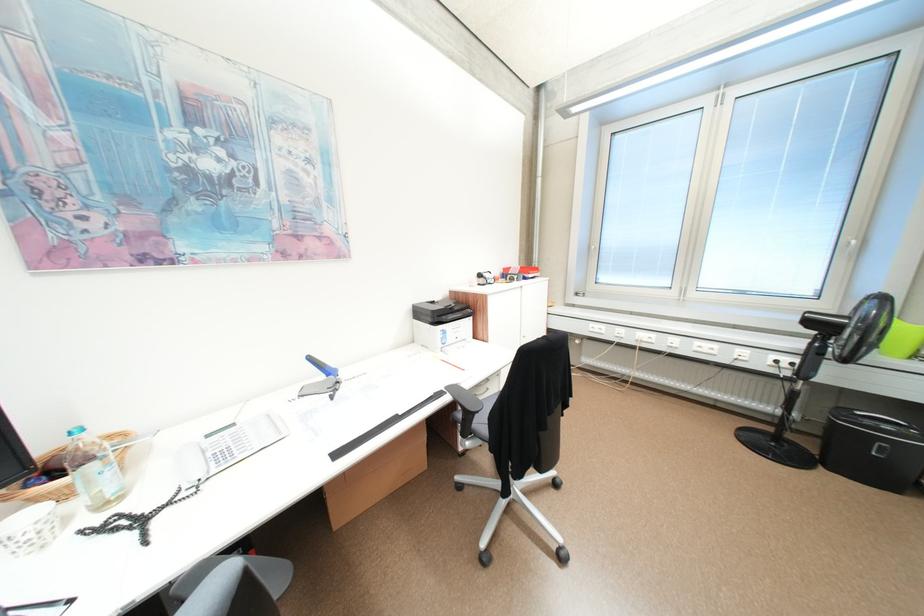
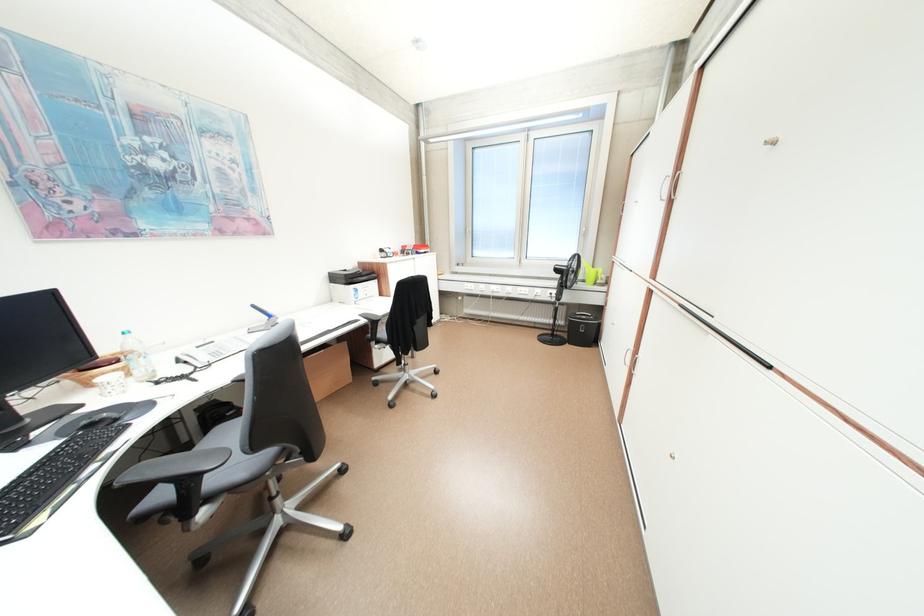
The point at (784, 444) is marked in the first image. Where is the corresponding point in the second image?

(561, 338)